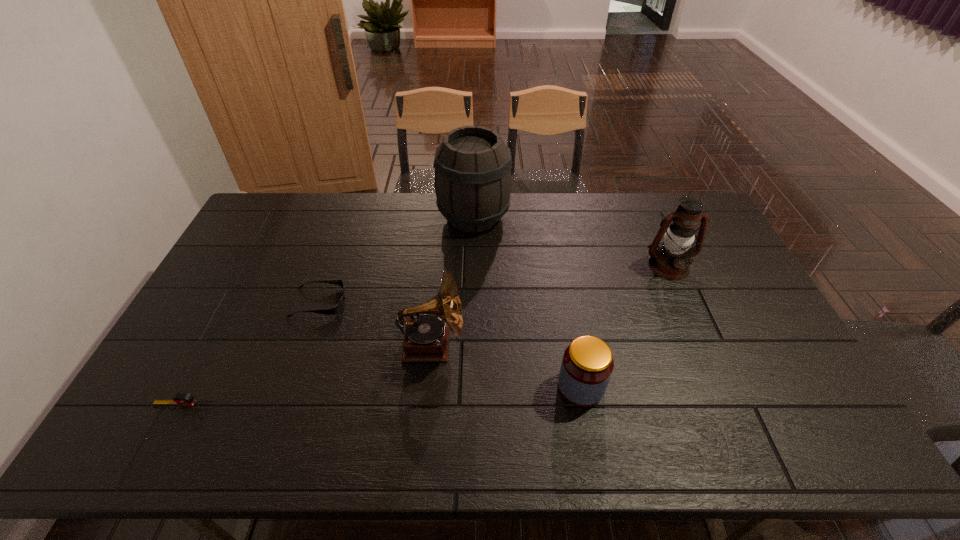
Locate an element on the screen. The image size is (960, 540). free space between the fifth nearest object and the farthest object is located at coordinates (571, 241).

Locate an element on the screen. This screenshot has height=540, width=960. unoccupied area between the second object from left to right and the second object from right to left is located at coordinates (450, 345).

Where is `empty location between the third tallest object and the sunglasses`? empty location between the third tallest object and the sunglasses is located at coordinates coord(375,323).

The image size is (960, 540). I want to click on object that is the fourth nearest to the second farthest object, so click(338, 307).

Identify the location of object identified as the closest to the second farthest object. This screenshot has width=960, height=540. (587, 365).

Locate an element on the screen. free space that satisfies the following two spatial constraints: 1. on the horn of the jar; 2. on the left side of the fourth shortest object is located at coordinates (427, 387).

This screenshot has width=960, height=540. I want to click on vacant point that satisfies the following two spatial constraints: 1. on the back side of the tape measure; 2. on the right side of the farthest object, so click(x=282, y=217).

At what (x,y) coordinates should I click in order to perform the action: click on vacant space that satisfies the following two spatial constraints: 1. on the back side of the second object from right to left; 2. on the front-facing side of the sunglasses. Please return your answer as a coordinate pair (x, y). This screenshot has width=960, height=540. Looking at the image, I should click on (565, 302).

The height and width of the screenshot is (540, 960). Identify the location of free space that satisfies the following two spatial constraints: 1. on the back side of the leftmost object; 2. on the left side of the second object from right to left. (194, 387).

The width and height of the screenshot is (960, 540). I want to click on vacant space that satisfies the following two spatial constraints: 1. on the side of the fifth nearest object, there is a wick adjustment knob; 2. on the front-facing side of the sunglasses, so (684, 302).